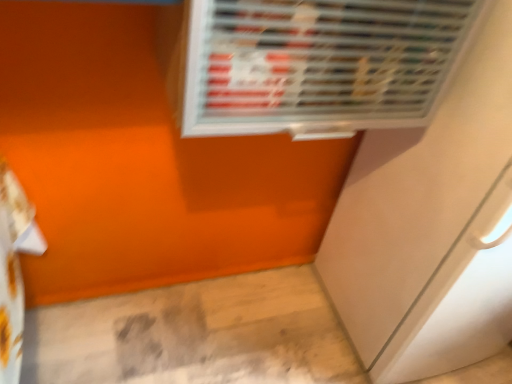
Question: From a real-world perspective, is metallic silver air conditioning at upper center positioned above or below white glossy screen door at lower right?

Choices:
 (A) above
 (B) below

Answer: (A)

Question: From the image's perspective, relative to white glossy screen door at lower right, is metallic silver air conditioning at upper center above or below?

Choices:
 (A) below
 (B) above

Answer: (B)

Question: Is metallic silver air conditioning at upper center bigger or smaller than white glossy screen door at lower right?

Choices:
 (A) small
 (B) big

Answer: (A)

Question: Is white glossy screen door at lower right to the left or to the right of metallic silver air conditioning at upper center in the image?

Choices:
 (A) right
 (B) left

Answer: (A)

Question: Considering the positions of point (393, 331) and point (437, 66), is point (393, 331) closer or farther from the camera than point (437, 66)?

Choices:
 (A) closer
 (B) farther

Answer: (B)

Question: From the image's perspective, is white glossy screen door at lower right positioned above or below metallic silver air conditioning at upper center?

Choices:
 (A) below
 (B) above

Answer: (A)

Question: In terms of height, does white glossy screen door at lower right look taller or shorter compared to metallic silver air conditioning at upper center?

Choices:
 (A) tall
 (B) short

Answer: (A)